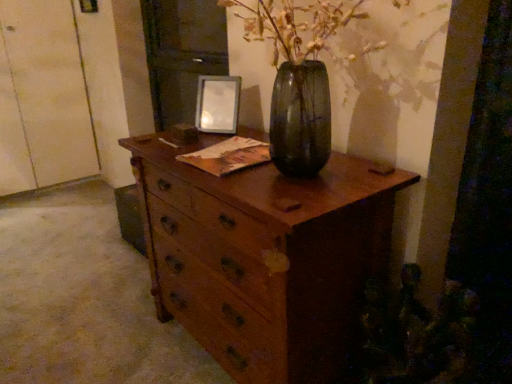
Question: Is point pos(60,173) positioned closer to the camera than point pos(216,236)?

Choices:
 (A) closer
 (B) farther

Answer: (B)

Question: From the image's perspective, relative to wooden chest of drawers at center, is white matte door at left above or below?

Choices:
 (A) above
 (B) below

Answer: (A)

Question: Which object is the farthest from the white matte door at left?

Choices:
 (A) metallic silver picture frame at upper center
 (B) wooden chest of drawers at center

Answer: (B)

Question: Considering the real-world distances, which object is farthest from the wooden chest of drawers at center?

Choices:
 (A) white matte door at left
 (B) metallic silver picture frame at upper center

Answer: (A)